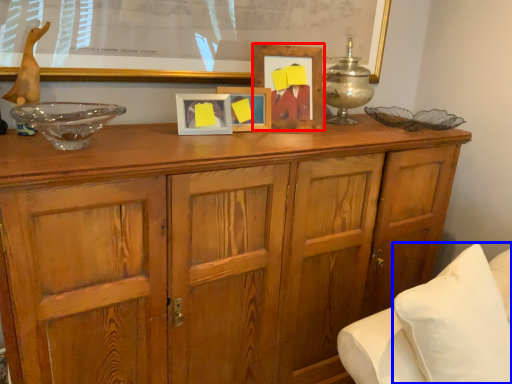
Question: Which of the following is the closest to the observer, picture frame (highlighted by a red box) or pillow (highlighted by a blue box)?

Choices:
 (A) picture frame
 (B) pillow

Answer: (B)